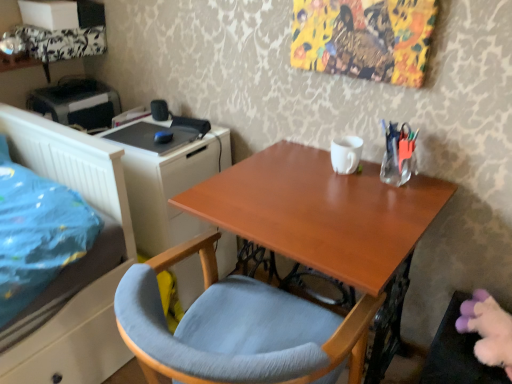
Question: In terms of width, does clear glass vase at upper right look wider or thinner when compared to white matte file cabinet at left?

Choices:
 (A) wide
 (B) thin

Answer: (B)

Question: From a real-world perspective, relative to white matte file cabinet at left, is clear glass vase at upper right vertically above or below?

Choices:
 (A) below
 (B) above

Answer: (B)

Question: Which object is positioned farthest from the clear glass vase at upper right?

Choices:
 (A) light blue fabric chair at center
 (B) wooden desk at center
 (C) white matte file cabinet at left
 (D) black plastic printer at upper left

Answer: (D)

Question: Which object is the closest to the black plastic printer at upper left?

Choices:
 (A) wooden desk at center
 (B) white matte file cabinet at left
 (C) light blue fabric chair at center
 (D) clear glass vase at upper right

Answer: (B)